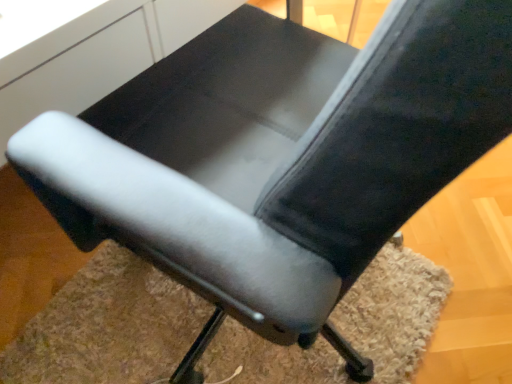
Describe the element at coordinates (108, 327) in the screenshot. The image size is (512, 384). I see `white fuzzy mat at lower center` at that location.

This screenshot has width=512, height=384. Identify the location of white fuzzy mat at lower center. (108, 327).

At what (x,y) coordinates should I click in order to perform the action: click on white fuzzy mat at lower center. Please return your answer as a coordinate pair (x, y). The width and height of the screenshot is (512, 384). Looking at the image, I should click on (108, 327).